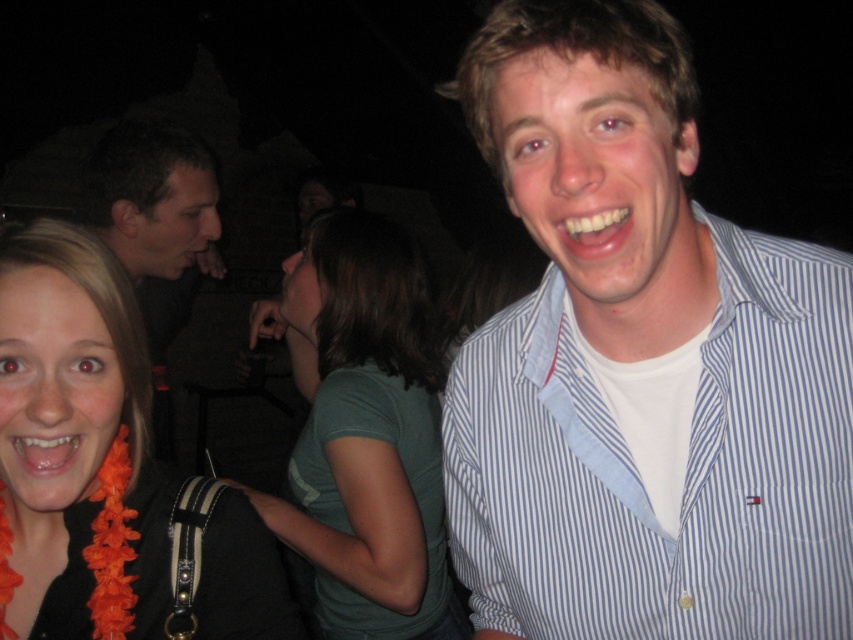
Question: Does orange flower garland at left appear over green matte shirt at center?

Choices:
 (A) no
 (B) yes

Answer: (B)

Question: Which of the following is the closest to the observer?

Choices:
 (A) (91, 177)
 (B) (123, 481)
 (C) (329, 371)

Answer: (B)

Question: Which is farther from the dark brown hair at upper left?

Choices:
 (A) white striped shirt at upper right
 (B) orange flower garland at left
 (C) green matte shirt at center

Answer: (A)

Question: Which of the following is the closest to the observer?

Choices:
 (A) dark brown hair at upper left
 (B) white striped shirt at upper right

Answer: (B)

Question: Is white striped shirt at upper right positioned before orange flower garland at left?

Choices:
 (A) yes
 (B) no

Answer: (A)

Question: Is white striped shirt at upper right bigger than green matte shirt at center?

Choices:
 (A) yes
 (B) no

Answer: (B)